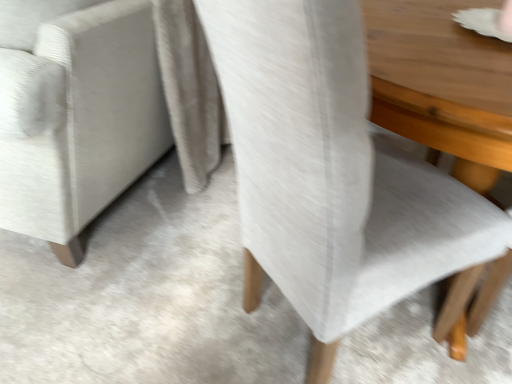
Question: Should I look upward or downward to see light gray fabric chair at center?

Choices:
 (A) down
 (B) up

Answer: (B)